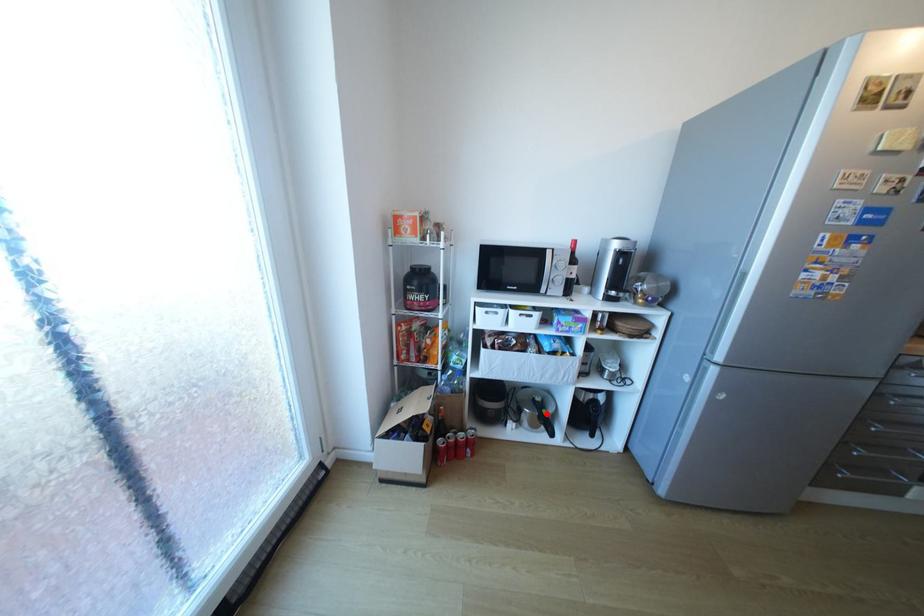
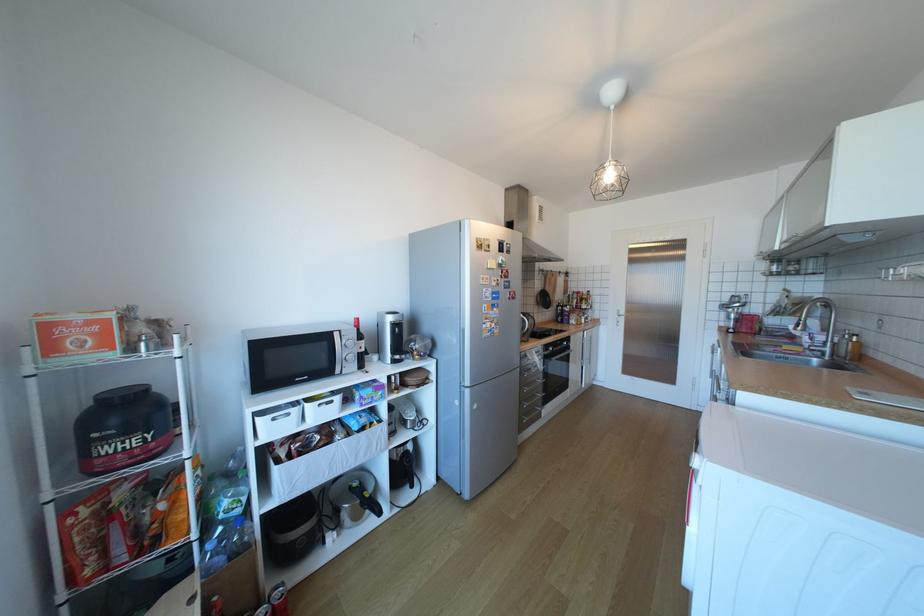
Question: A red point is marked in image1. In image2, is the corresponding 3D point closer to the camera or farther? Reply with the corresponding letter.

Choices:
 (A) The corresponding 3D point is closer.
 (B) The corresponding 3D point is farther.

Answer: (A)